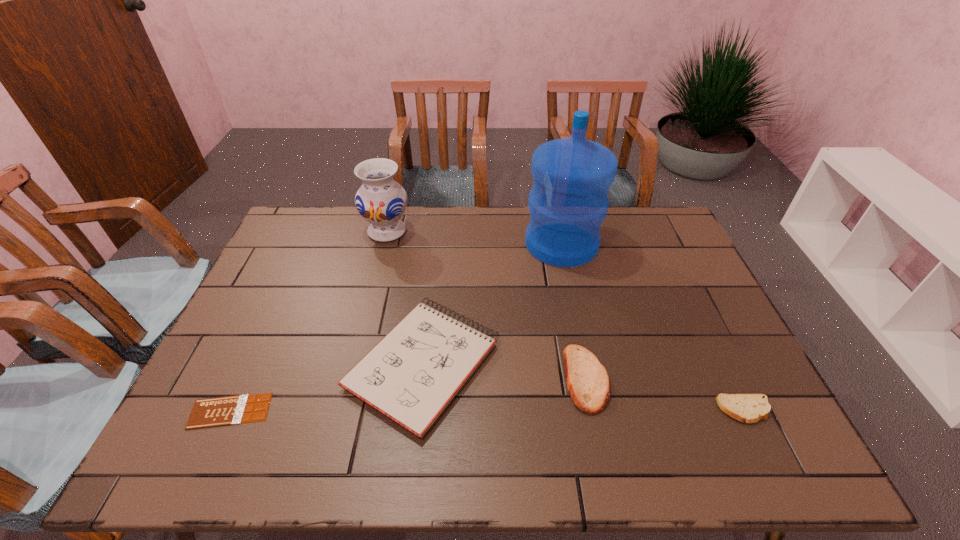
Locate an element on the screen. free space between the tallest object and the vase is located at coordinates (474, 238).

Find the location of `the second closest object to the notepad`. the second closest object to the notepad is located at coordinates (587, 381).

The height and width of the screenshot is (540, 960). Find the location of `the closest object to the second shortest object`. the closest object to the second shortest object is located at coordinates (587, 381).

I want to click on free space that satisfies the following two spatial constraints: 1. on the back side of the water jug; 2. on the right side of the left pita bread, so click(x=558, y=244).